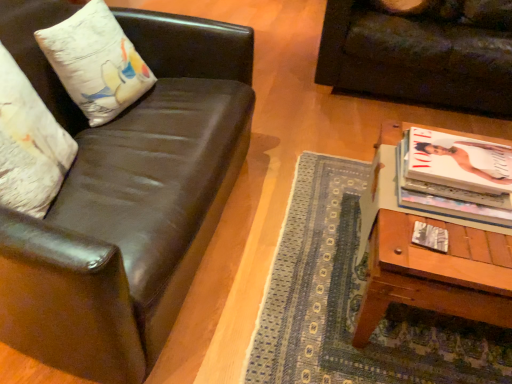
The width and height of the screenshot is (512, 384). Identify the location of free space behind matte white magazine at right. (415, 215).